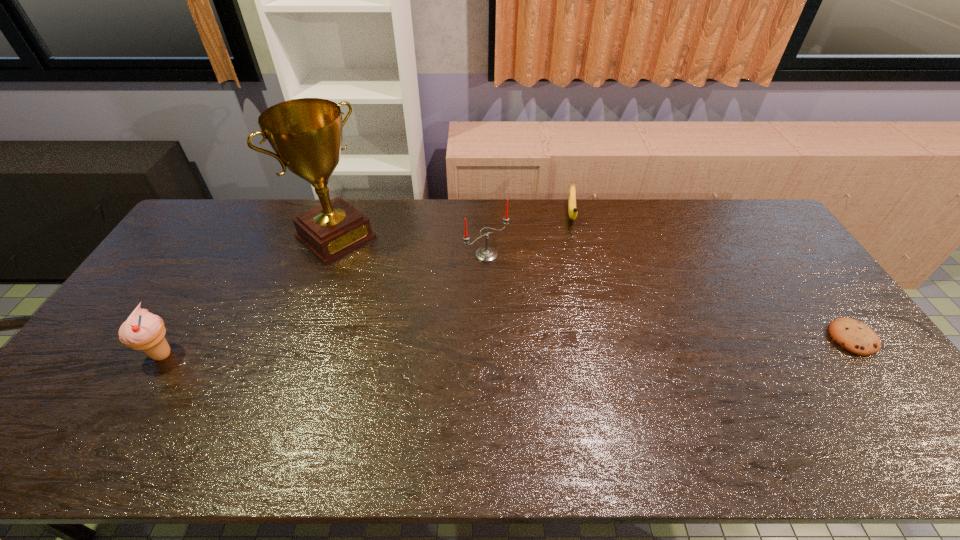
The height and width of the screenshot is (540, 960). I want to click on vacant area situated on the front-facing side of the third object from left to right, so click(515, 276).

The width and height of the screenshot is (960, 540). I want to click on free space located 0.220m on the front-facing side of the third object from left to right, so click(548, 305).

Locate an element on the screen. vacant space situated on the front-facing side of the third object from left to right is located at coordinates (519, 280).

This screenshot has width=960, height=540. I want to click on vacant region located at the stem of the second shortest object, so click(x=581, y=315).

You are a GUI agent. You are given a task and a screenshot of the screen. Output one action in this format:
    pyautogui.click(x=<x>, y=<y>)
    Task: Click on the vacant region located 0.080m at the stem of the second shortest object
    Image resolution: width=960 pixels, height=540 pixels.
    Given the screenshot: What is the action you would take?
    pyautogui.click(x=576, y=245)

Locate an element on the screen. The image size is (960, 540). vacant region located at the stem of the second shortest object is located at coordinates (579, 287).

This screenshot has height=540, width=960. What are the coordinates of `vacant space located 0.180m on the plaque of the award` in the screenshot? It's located at (391, 286).

The width and height of the screenshot is (960, 540). Find the location of `vacant space located on the plaque of the award`. vacant space located on the plaque of the award is located at coordinates (372, 269).

Find the location of `free space located on the plaque of the award`. free space located on the plaque of the award is located at coordinates (428, 318).

You are a GUI agent. You are given a task and a screenshot of the screen. Output one action in this format:
    pyautogui.click(x=<x>, y=<y>)
    Task: Click on the banana located in the far edge section of the desktop
    
    Given the screenshot: What is the action you would take?
    pyautogui.click(x=572, y=209)